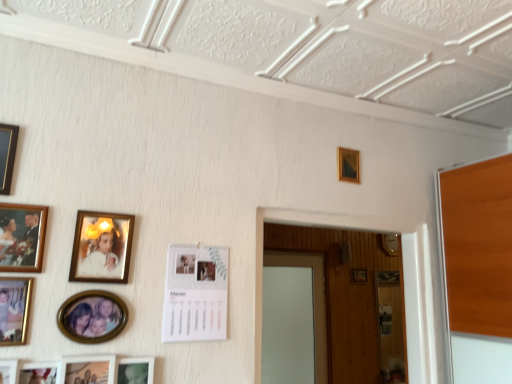
What is the approximate height of matte gold picture frame at left, which is counted as the 7th picture frame, starting from the back?

matte gold picture frame at left, which is counted as the 7th picture frame, starting from the back, is 8.41 inches in height.

This screenshot has height=384, width=512. Describe the element at coordinates (7, 155) in the screenshot. I see `matte black picture frame at upper left, which appears as the eighth picture frame when viewed from the back` at that location.

What do you see at coordinates (348, 165) in the screenshot? The height and width of the screenshot is (384, 512). I see `gold metallic picture frame at upper center, the second picture frame when ordered from right to left` at bounding box center [348, 165].

Measure the distance between point (352, 165) and camera.

The depth of point (352, 165) is 6.32 feet.

Measure the distance between point (127, 363) and camera.

4.43 feet.

The image size is (512, 384). What do you see at coordinates (135, 371) in the screenshot?
I see `matte white photo frame at lower left, the fifth picture frame viewed from the back` at bounding box center [135, 371].

Describe the element at coordinates (359, 276) in the screenshot. I see `wooden picture frame at upper center, which is the twelfth picture frame in left-to-right order` at that location.

What is the approximate width of white paper calendar at center, marked as the third picture frame in a right-to-left arrangement?

white paper calendar at center, marked as the third picture frame in a right-to-left arrangement, is 0.82 inches wide.

Find the location of a particular element. gold-framed photo at lower left, positioned as the 10th picture frame in right-to-left order is located at coordinates (14, 309).

Can you confirm if gold metallic picture frame at upper center, arranged as the eleventh picture frame when viewed from the front, is thinner than frosted glass door at center?

Yes, gold metallic picture frame at upper center, arranged as the eleventh picture frame when viewed from the front, is thinner than frosted glass door at center.

Is gold metallic picture frame at upper center, which is the eleventh picture frame in left-to-right order, taller than frosted glass door at center?

No, gold metallic picture frame at upper center, which is the eleventh picture frame in left-to-right order, is not taller than frosted glass door at center.

Is gold metallic picture frame at upper center, the second picture frame when ordered from right to left, outside of frosted glass door at center?

gold metallic picture frame at upper center, the second picture frame when ordered from right to left, is positioned outside frosted glass door at center.

Considering the sizes of wooden picture frame at upper center, acting as the first picture frame starting from the right, and matte white photo frame at lower left, the fifth picture frame viewed from the back, in the image, is wooden picture frame at upper center, acting as the first picture frame starting from the right, taller or shorter than matte white photo frame at lower left, the fifth picture frame viewed from the back,?

Considering their sizes, wooden picture frame at upper center, acting as the first picture frame starting from the right, has less height than matte white photo frame at lower left, the fifth picture frame viewed from the back.

From a real-world perspective, who is located lower, wooden picture frame at upper center, acting as the twelfth picture frame starting from the front, or matte white photo frame at lower left, which is the 8th picture frame in front-to-back order?

matte white photo frame at lower left, which is the 8th picture frame in front-to-back order, from a real-world perspective.

Which is closer to the camera, (361, 274) or (146, 380)?

The point (146, 380) is in front.

Looking at this image, between wooden picture frame at upper center, acting as the first picture frame starting from the right, and matte silver picture frame at lower left, which ranks as the 6th picture frame in left-to-right order, which one has smaller width?

wooden picture frame at upper center, acting as the first picture frame starting from the right.

Which object is closer to the camera, wooden picture frame at upper center, arranged as the 1th picture frame when viewed from the back, or matte silver picture frame at lower left, the 7th picture frame in the right-to-left sequence?

matte silver picture frame at lower left, the 7th picture frame in the right-to-left sequence, is more forward.

Does wooden picture frame at upper center, arranged as the 1th picture frame when viewed from the back, touch matte silver picture frame at lower left, the 7th picture frame in the right-to-left sequence?

wooden picture frame at upper center, arranged as the 1th picture frame when viewed from the back, and matte silver picture frame at lower left, the 7th picture frame in the right-to-left sequence, are not in contact.

Considering the positions of objects matte gold picture frame at upper left, the fourth picture frame positioned from the back, and wooden picture frame at upper center, acting as the twelfth picture frame starting from the front, in the image provided, who is in front, matte gold picture frame at upper left, the fourth picture frame positioned from the back, or wooden picture frame at upper center, acting as the twelfth picture frame starting from the front,?

matte gold picture frame at upper left, the fourth picture frame positioned from the back, is in front.

Is matte gold picture frame at upper left, the fourth picture frame positioned from the back, bigger than wooden picture frame at upper center, which is the twelfth picture frame in left-to-right order?

Correct, matte gold picture frame at upper left, the fourth picture frame positioned from the back, is larger in size than wooden picture frame at upper center, which is the twelfth picture frame in left-to-right order.

Does matte gold picture frame at upper left, positioned as the ninth picture frame in front-to-back order, appear on the left side of wooden picture frame at upper center, arranged as the 1th picture frame when viewed from the back?

Yes.

Which object is wider, gold-framed photo at lower left, the 3th picture frame in the left-to-right sequence, or matte gold picture frame at lower left, which ranks as the 7th picture frame in left-to-right order?

Wider between the two is matte gold picture frame at lower left, which ranks as the 7th picture frame in left-to-right order.

From a real-world perspective, which is physically above, gold-framed photo at lower left, the 3th picture frame in the left-to-right sequence, or matte gold picture frame at lower left, placed as the seventh picture frame when sorted from front to back?

Answer: gold-framed photo at lower left, the 3th picture frame in the left-to-right sequence, is physically above.

From the image's perspective, between gold-framed photo at lower left, positioned as the 10th picture frame in right-to-left order, and matte gold picture frame at lower left, the 6th picture frame viewed from the right, who is located below?

matte gold picture frame at lower left, the 6th picture frame viewed from the right.

Which object is further away from the camera, gold-framed photo at lower left, the 3th picture frame in the left-to-right sequence, or matte gold picture frame at lower left, which appears as the 6th picture frame when viewed from the back?

matte gold picture frame at lower left, which appears as the 6th picture frame when viewed from the back.

Does point (144, 360) lie behind point (360, 275)?

No.

Is matte white photo frame at lower left, which is the 8th picture frame in front-to-back order, not close to wooden picture frame at upper center, acting as the twelfth picture frame starting from the front?

That's right, there is a large distance between matte white photo frame at lower left, which is the 8th picture frame in front-to-back order, and wooden picture frame at upper center, acting as the twelfth picture frame starting from the front.

Is matte white photo frame at lower left, the fifth picture frame viewed from the back, aimed at wooden picture frame at upper center, acting as the twelfth picture frame starting from the front?

No, matte white photo frame at lower left, the fifth picture frame viewed from the back, is not turned towards wooden picture frame at upper center, acting as the twelfth picture frame starting from the front.

Is white paper calendar at center, the tenth picture frame in the left-to-right sequence, not near wooden picture frame at upper center, acting as the first picture frame starting from the right?

Yes, white paper calendar at center, the tenth picture frame in the left-to-right sequence, is far from wooden picture frame at upper center, acting as the first picture frame starting from the right.

How different are the orientations of white paper calendar at center, marked as the tenth picture frame in a front-to-back arrangement, and wooden picture frame at upper center, arranged as the 1th picture frame when viewed from the back, in degrees?

The facing directions of white paper calendar at center, marked as the tenth picture frame in a front-to-back arrangement, and wooden picture frame at upper center, arranged as the 1th picture frame when viewed from the back, are 0.601 degrees apart.

Consider the image. Is white paper calendar at center, the 3th picture frame in the back-to-front sequence, turned away from wooden picture frame at upper center, acting as the twelfth picture frame starting from the front?

That's not correct — white paper calendar at center, the 3th picture frame in the back-to-front sequence, is not looking away from wooden picture frame at upper center, acting as the twelfth picture frame starting from the front.

Where is `the 1st picture frame counting from the right side of the frosted glass door at center`? The height and width of the screenshot is (384, 512). the 1st picture frame counting from the right side of the frosted glass door at center is located at coordinates (348, 165).

Identify the location of picture frame that is the 4th object located behind the matte white photo frame at lower left, which is the 8th picture frame in front-to-back order. This screenshot has height=384, width=512. pos(359,276).

Estimate the real-world distances between objects in this image. Which object is closer to gold metallic picture frame at upper center, arranged as the eleventh picture frame when viewed from the front, matte black picture frame at upper left, arranged as the 1th picture frame when viewed from the left, or white paper calendar at center, marked as the third picture frame in a right-to-left arrangement?

white paper calendar at center, marked as the third picture frame in a right-to-left arrangement, is positioned closer to the anchor gold metallic picture frame at upper center, arranged as the eleventh picture frame when viewed from the front.

Estimate the real-world distances between objects in this image. Which object is closer to matte black picture frame at upper left, which appears as the eighth picture frame when viewed from the back, matte gold picture frame at upper left, the fourth picture frame positioned from the back, or frosted glass door at center?

Based on the image, matte gold picture frame at upper left, the fourth picture frame positioned from the back, appears to be nearer to matte black picture frame at upper left, which appears as the eighth picture frame when viewed from the back.

Looking at the image, which one is located further to wooden photo frame at lower left, the 2th picture frame in the left-to-right sequence, white paper calendar at center, the 3th picture frame in the back-to-front sequence, or matte gold picture frame at upper left, positioned as the ninth picture frame in front-to-back order?

white paper calendar at center, the 3th picture frame in the back-to-front sequence, is positioned further to the anchor wooden photo frame at lower left, the 2th picture frame in the left-to-right sequence.

When comparing their distances from matte gold picture frame at left, which is the 9th picture frame from right to left, does matte gold picture frame at upper left, the 8th picture frame from the left, or frosted glass door at center seem closer?

Among the two, matte gold picture frame at upper left, the 8th picture frame from the left, is located nearer to matte gold picture frame at left, which is the 9th picture frame from right to left.

Based on their spatial positions, is wooden photo frame at lower left, which ranks as the 12th picture frame in back-to-front order, or white paper calendar at center, marked as the tenth picture frame in a front-to-back arrangement, further from matte black picture frame at lower left, acting as the second picture frame starting from the front?

white paper calendar at center, marked as the tenth picture frame in a front-to-back arrangement, lies further to matte black picture frame at lower left, acting as the second picture frame starting from the front, than the other object.

Based on their spatial positions, is frosted glass door at center or gold metallic picture frame at upper center, the second picture frame when ordered from right to left, closer to matte gold picture frame at left, which is the 9th picture frame from right to left?

gold metallic picture frame at upper center, the second picture frame when ordered from right to left, is closer to matte gold picture frame at left, which is the 9th picture frame from right to left.

When comparing their distances from gold-framed photo at lower left, the 10th picture frame from the back, does wooden photo frame at lower left, which ranks as the 12th picture frame in back-to-front order, or wooden picture frame at upper center, which is the twelfth picture frame in left-to-right order, seem further?

Based on the image, wooden picture frame at upper center, which is the twelfth picture frame in left-to-right order, appears to be further to gold-framed photo at lower left, the 10th picture frame from the back.

Estimate the real-world distances between objects in this image. Which object is further from gold-framed photo at lower left, the 10th picture frame from the back, matte silver picture frame at lower left, which appears as the fourth picture frame when viewed from the front, or gold metallic picture frame at upper center, which is the eleventh picture frame in left-to-right order?

Among the two, gold metallic picture frame at upper center, which is the eleventh picture frame in left-to-right order, is located further to gold-framed photo at lower left, the 10th picture frame from the back.

Identify the location of door between matte gold picture frame at upper left, the fourth picture frame positioned from the back, and wooden picture frame at upper center, arranged as the 1th picture frame when viewed from the back, along the z-axis. The height and width of the screenshot is (384, 512). (315, 299).

Where is `door between matte silver picture frame at lower left, placed as the ninth picture frame when sorted from back to front, and wooden picture frame at upper center, acting as the first picture frame starting from the right, along the z-axis`? The width and height of the screenshot is (512, 384). door between matte silver picture frame at lower left, placed as the ninth picture frame when sorted from back to front, and wooden picture frame at upper center, acting as the first picture frame starting from the right, along the z-axis is located at coordinates (315, 299).

At what (x,y) coordinates should I click in order to perform the action: click on picture frame located between white paper calendar at center, marked as the third picture frame in a right-to-left arrangement, and frosted glass door at center in the depth direction. Please return your answer as a coordinate pair (x, y). Looking at the image, I should click on (348, 165).

The image size is (512, 384). I want to click on door between matte gold picture frame at lower left, which ranks as the 7th picture frame in left-to-right order, and wooden picture frame at upper center, arranged as the 1th picture frame when viewed from the back, along the z-axis, so click(315, 299).